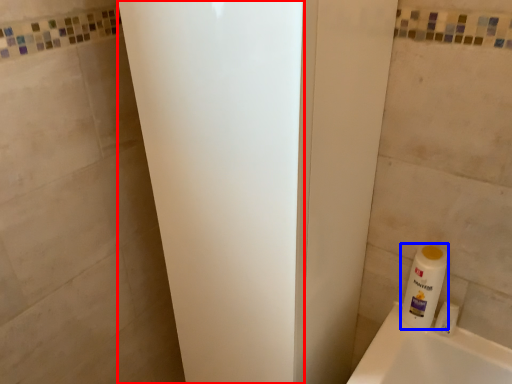
Question: Which object is closer to the camera taking this photo, screen door (highlighted by a red box) or cleaning product (highlighted by a blue box)?

Choices:
 (A) screen door
 (B) cleaning product

Answer: (A)